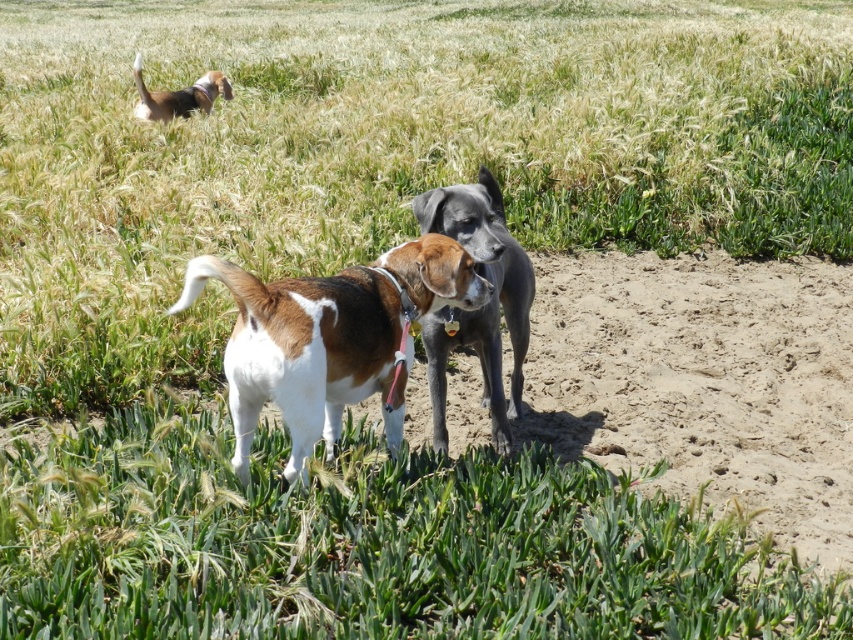
Can you confirm if brown and white fur dog at center is positioned below smooth gray dog at center?

No.

Can you confirm if brown and white fur dog at center is positioned to the left of smooth gray dog at center?

Yes, brown and white fur dog at center is to the left of smooth gray dog at center.

Between point (234, 269) and point (498, 449), which one is positioned in front?

Point (234, 269) is in front.

The height and width of the screenshot is (640, 853). I want to click on brown and white fur dog at center, so [x=329, y=339].

Is brown and white fur dog at center positioned at the back of brown and white fur at upper left?

No, it is in front of brown and white fur at upper left.

Does brown and white fur dog at center appear on the right side of brown and white fur at upper left?

Correct, you'll find brown and white fur dog at center to the right of brown and white fur at upper left.

Is point (457, 250) farther from viewer compared to point (216, 84)?

No, (457, 250) is closer to viewer.

Find the location of a particular element. brown and white fur dog at center is located at coordinates (329, 339).

Can you confirm if smooth gray dog at center is taller than brown and white fur at upper left?

Indeed, smooth gray dog at center has a greater height compared to brown and white fur at upper left.

Can you confirm if smooth gray dog at center is positioned above brown and white fur at upper left?

Incorrect, smooth gray dog at center is not positioned above brown and white fur at upper left.

I want to click on smooth gray dog at center, so click(482, 307).

Find the location of a particular element. This screenshot has width=853, height=640. smooth gray dog at center is located at coordinates (482, 307).